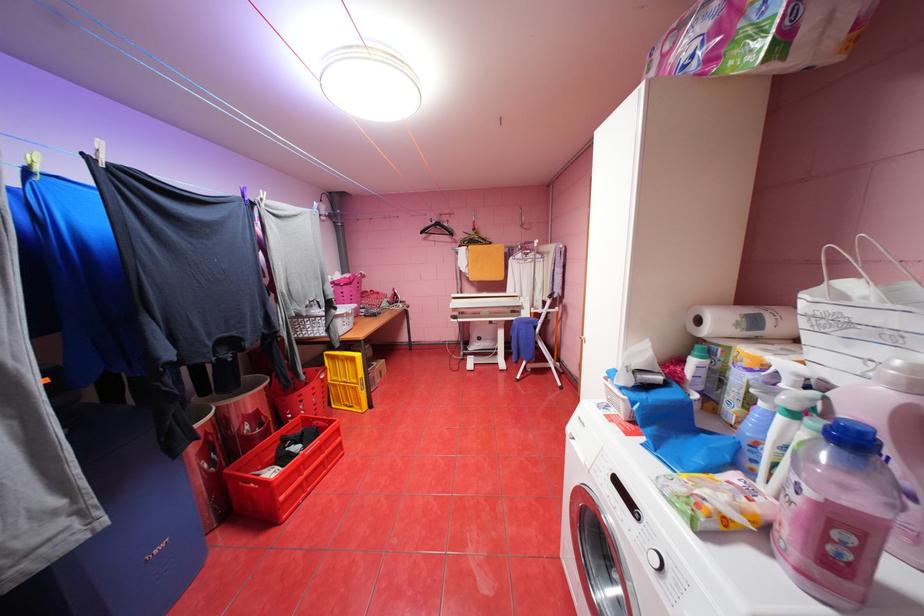
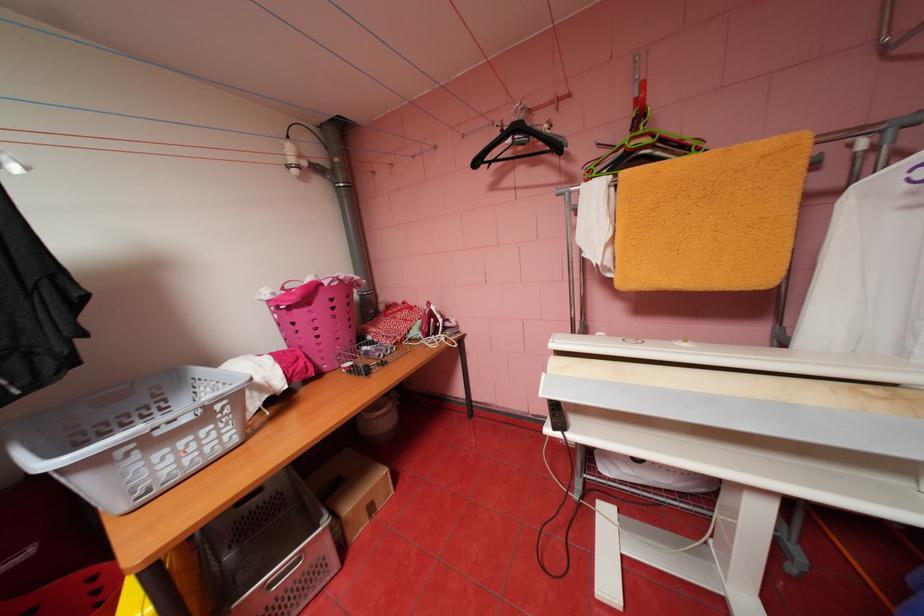
Question: What movement of the cameraman would produce the second image?

Choices:
 (A) Left
 (B) Right
 (C) Forward
 (D) Backward

Answer: (C)